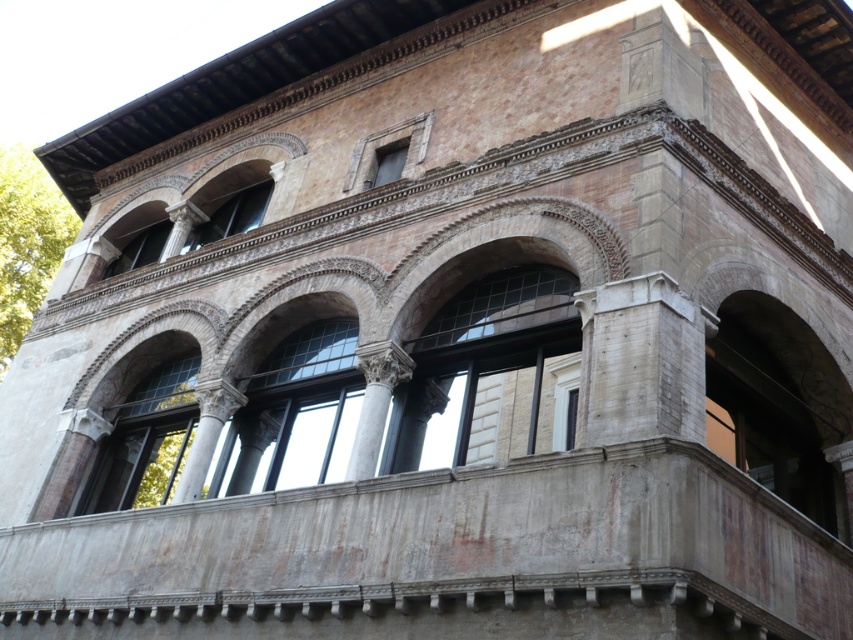
You are an architect analyzing the perspective of the building. You observe two points on the facade at coordinates point (300, 364) and point (160, 244). Which point appears closer to you when looking at the building?

Point (300, 364) is closer to the camera than point (160, 244).

You are a tourist standing at the entrance of the historic building. You want to take a photo of the clear glass window at center. Given that your camera has a maximum focus range of 35 meters, will you be able to capture the window clearly?

The clear glass window at center is 37.92 meters away from the camera. Since the camera can only focus up to 35 meters, it won not be able to capture the window clearly.

You are an architect analyzing the symmetry of the building. The clear glass window at center is positioned at coordinates 0.648, 0.347. Does this placement align with the building design principles of symmetry?

The clear glass window at center is positioned at coordinates (294, 413), which suggests it is centrally located in the building facade, aligning with the Renaissance or Baroque architectural style that emphasizes symmetry and balanced proportions.